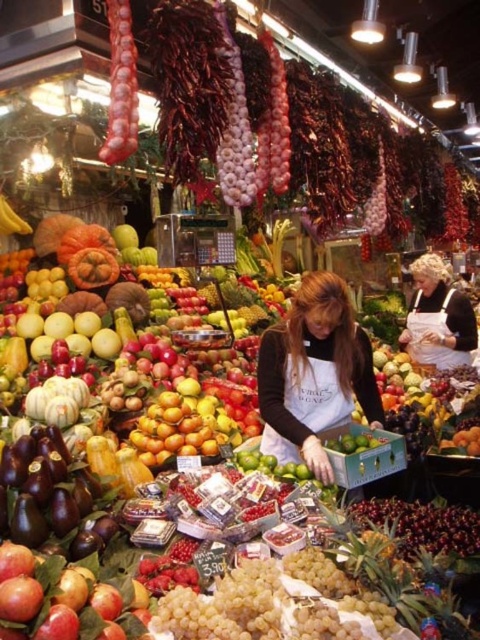
Can you confirm if matte black apron at center is positioned to the left of black matte apron at center?

Yes, matte black apron at center is to the left of black matte apron at center.

Is point (333, 476) positioned behind point (441, 352)?

No.

Which is behind, point (336, 317) or point (416, 266)?

The point (416, 266) is behind.

This screenshot has height=640, width=480. In order to click on matte black apron at center in this screenshot , I will do click(x=313, y=372).

Measure the distance from black matte apron at center to shiny golden oranges at center.

black matte apron at center is 2.98 meters away from shiny golden oranges at center.

Is point (456, 358) in front of point (164, 416)?

No, it is not.

Is point (442, 333) positioned before point (197, 452)?

No, it is not.

Locate an element on the screen. black matte apron at center is located at coordinates (437, 317).

Identify the location of matte black apron at center. (313, 372).

Who is positioned more to the left, matte black apron at center or shiny golden oranges at center?

shiny golden oranges at center is more to the left.

This screenshot has height=640, width=480. I want to click on matte black apron at center, so click(x=313, y=372).